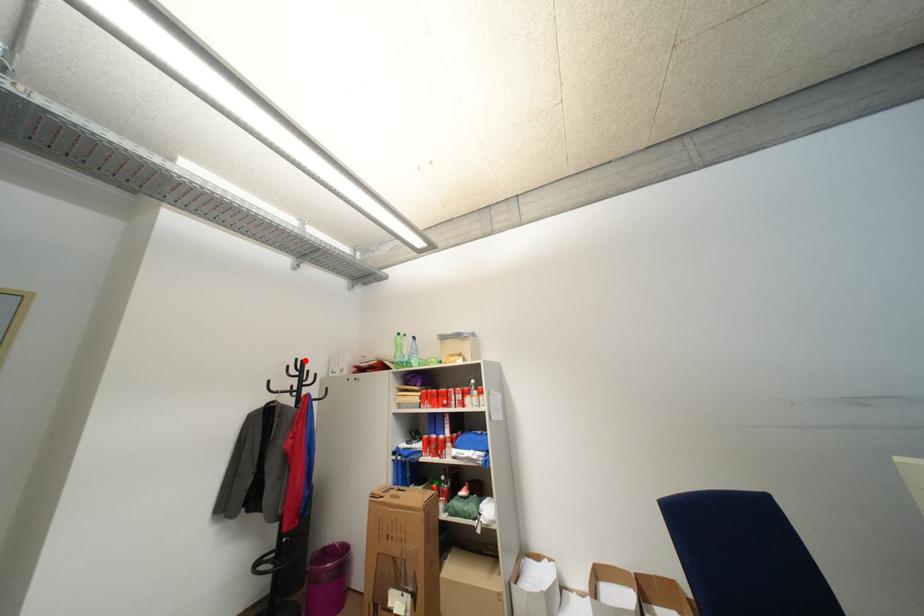
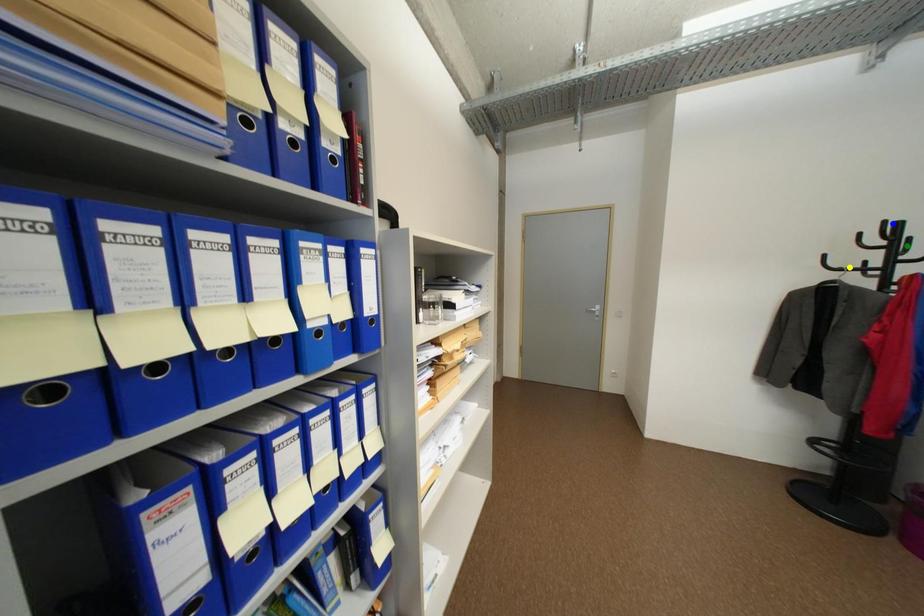
Question: I am providing you with two images of the same scene from different viewpoints. A red point is marked on the first image. You are given multiple points on the second image. Which mark in image 2 goes with the point in image 1?

Choices:
 (A) blue point
 (B) yellow point
 (C) green point

Answer: (A)